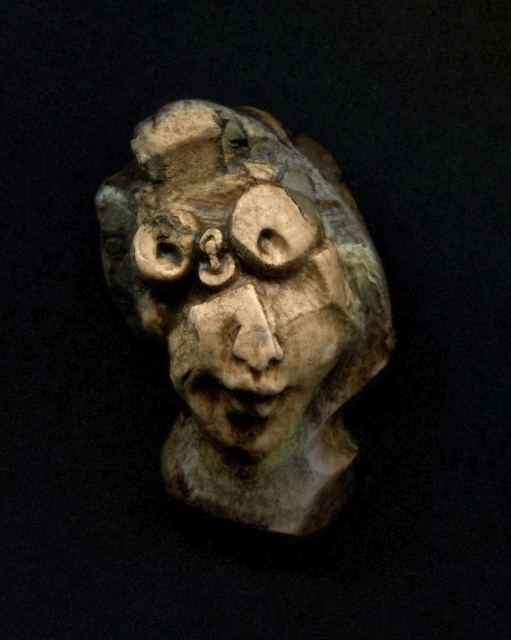
Question: Can you confirm if matte stone sculpture at center is thinner than carved stone face at center?

Choices:
 (A) yes
 (B) no

Answer: (B)

Question: Observing the image, what is the correct spatial positioning of matte stone sculpture at center in reference to carved stone face at center?

Choices:
 (A) above
 (B) below

Answer: (A)

Question: Which point is closer to the camera?

Choices:
 (A) (355, 211)
 (B) (188, 326)

Answer: (B)

Question: Does matte stone sculpture at center appear on the right side of carved stone face at center?

Choices:
 (A) no
 (B) yes

Answer: (B)

Question: Which of the following is the farthest from the observer?

Choices:
 (A) carved stone face at center
 (B) matte stone sculpture at center

Answer: (B)